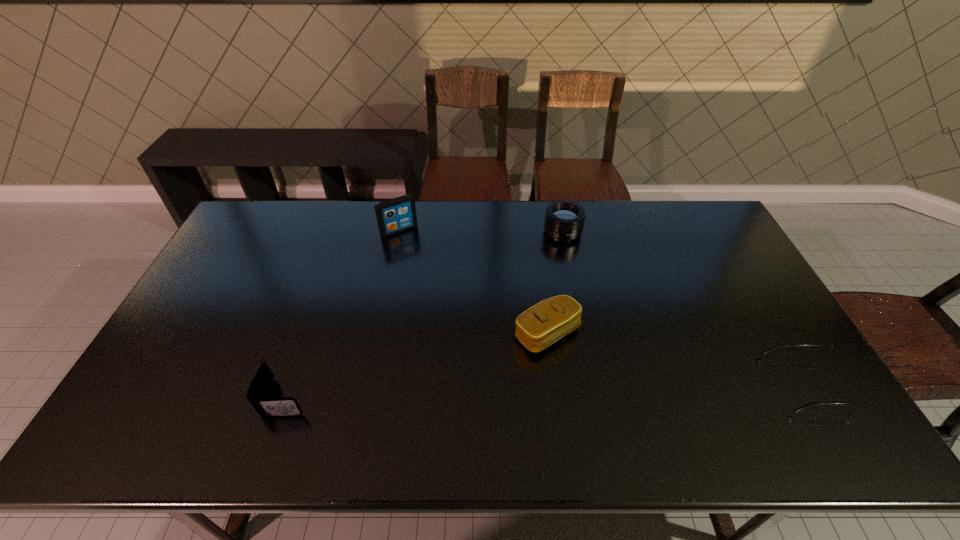
Where is `free space on the desktop that is between the wallet and the rightmost object and is positioned on the zipper side of the clutch bag`? The image size is (960, 540). free space on the desktop that is between the wallet and the rightmost object and is positioned on the zipper side of the clutch bag is located at coordinates pyautogui.click(x=597, y=389).

You are a GUI agent. You are given a task and a screenshot of the screen. Output one action in this format:
    pyautogui.click(x=<x>, y=<y>)
    Task: Click on the vacant spot on the desktop that is between the leftmost object and the shortest object and is positioned on the front screen of the tallest object
    The width and height of the screenshot is (960, 540).
    Given the screenshot: What is the action you would take?
    pyautogui.click(x=506, y=392)

Find the location of a particular element. vacant space on the desktop that is between the leftmost object and the rightmost object and is positioned on the side of the telephoto lens with brand markings and control switches is located at coordinates (495, 392).